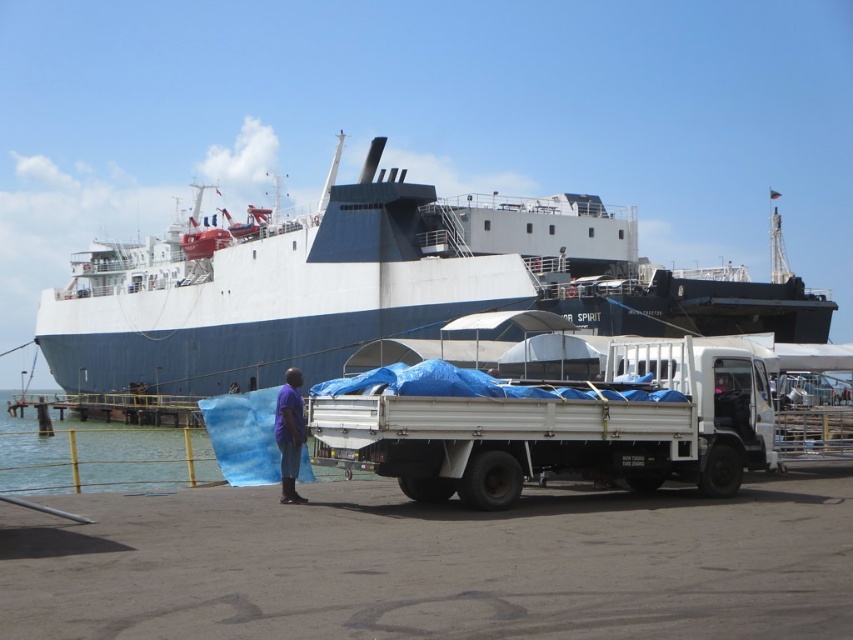
Question: Which of the following is the closest to the observer?

Choices:
 (A) (393, 202)
 (B) (595, 480)
 (C) (49, 486)

Answer: (B)

Question: Which object is closer to the camera taking this photo?

Choices:
 (A) white matte trailer truck at center
 (B) white matte ship at upper center

Answer: (A)

Question: Is white matte ship at upper center positioned before purple fabric at center?

Choices:
 (A) yes
 (B) no

Answer: (B)

Question: From the image, what is the correct spatial relationship of white matte trailer truck at center in relation to blue water at lower left?

Choices:
 (A) below
 (B) above

Answer: (B)

Question: Can you confirm if blue water at lower left is thinner than purple fabric at center?

Choices:
 (A) yes
 (B) no

Answer: (B)

Question: Which object appears closest to the camera in this image?

Choices:
 (A) blue water at lower left
 (B) white matte trailer truck at center
 (C) white matte ship at upper center
 (D) purple fabric at center

Answer: (B)